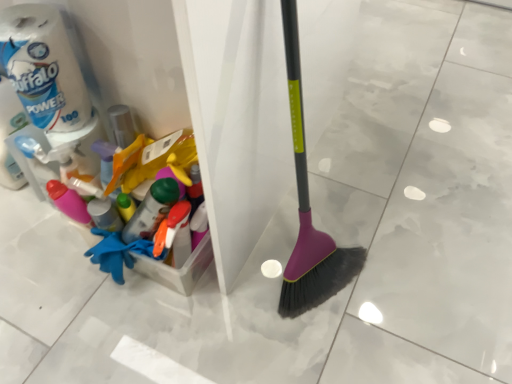
Question: Is white matte toilet paper at upper left, which ranks as the second toilet paper in left-to-right order, taller or shorter than white matte toilet paper at left, which is the second toilet paper in right-to-left order?

Choices:
 (A) tall
 (B) short

Answer: (B)

Question: Considering the positions of white matte toilet paper at upper left, the 1th toilet paper in the right-to-left sequence, and white matte toilet paper at left, arranged as the 1th toilet paper when viewed from the left, in the image, is white matte toilet paper at upper left, the 1th toilet paper in the right-to-left sequence, wider or thinner than white matte toilet paper at left, arranged as the 1th toilet paper when viewed from the left,?

Choices:
 (A) thin
 (B) wide

Answer: (A)

Question: Visually, is white matte toilet paper at upper left, which ranks as the second toilet paper in left-to-right order, positioned to the left or to the right of white matte toilet paper at left, arranged as the 1th toilet paper when viewed from the left?

Choices:
 (A) right
 (B) left

Answer: (A)

Question: From a real-world perspective, is white matte toilet paper at left, which is the second toilet paper in right-to-left order, above or below white matte toilet paper at upper left, the 1th toilet paper in the right-to-left sequence?

Choices:
 (A) below
 (B) above

Answer: (A)

Question: In terms of height, does white matte toilet paper at left, which is the second toilet paper in right-to-left order, look taller or shorter compared to white matte toilet paper at upper left, which ranks as the second toilet paper in left-to-right order?

Choices:
 (A) tall
 (B) short

Answer: (A)

Question: Relative to white matte toilet paper at upper left, which ranks as the second toilet paper in left-to-right order, is white matte toilet paper at left, which is the second toilet paper in right-to-left order, in front or behind?

Choices:
 (A) front
 (B) behind

Answer: (B)

Question: Looking at the image, does white matte toilet paper at left, arranged as the 1th toilet paper when viewed from the left, seem bigger or smaller compared to white matte toilet paper at upper left, which ranks as the second toilet paper in left-to-right order?

Choices:
 (A) small
 (B) big

Answer: (B)